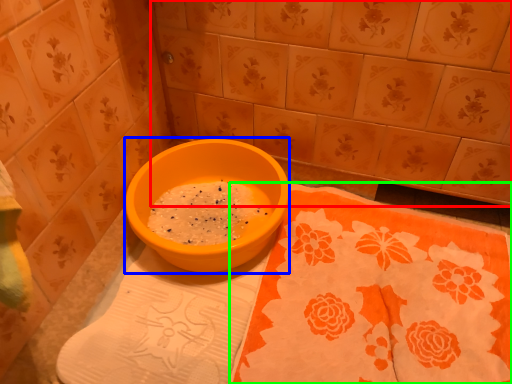
Question: Which object is the farthest from ceramic tile (highlighted by a red box)? Choose among these: basin (highlighted by a blue box) or tablecloth (highlighted by a green box).

Choices:
 (A) basin
 (B) tablecloth

Answer: (B)